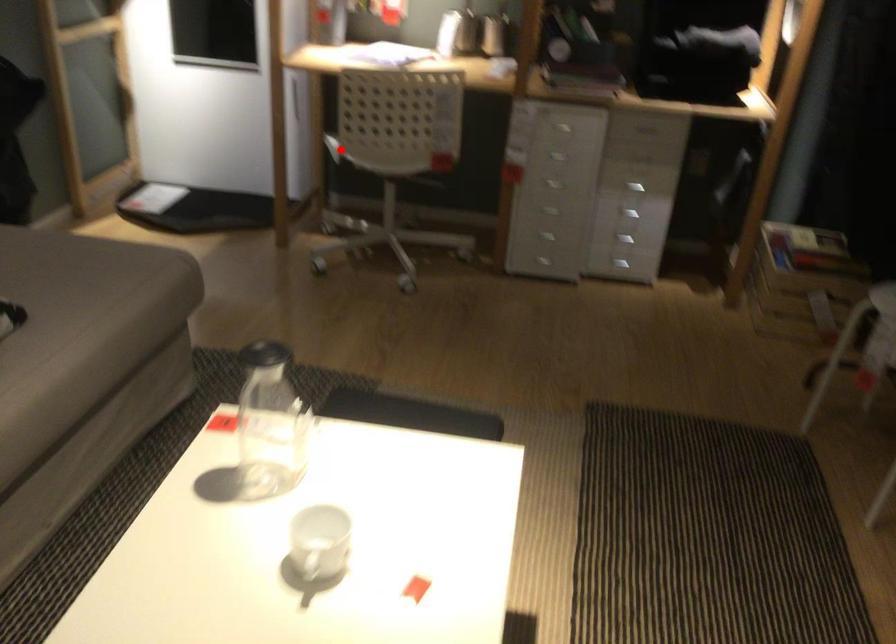
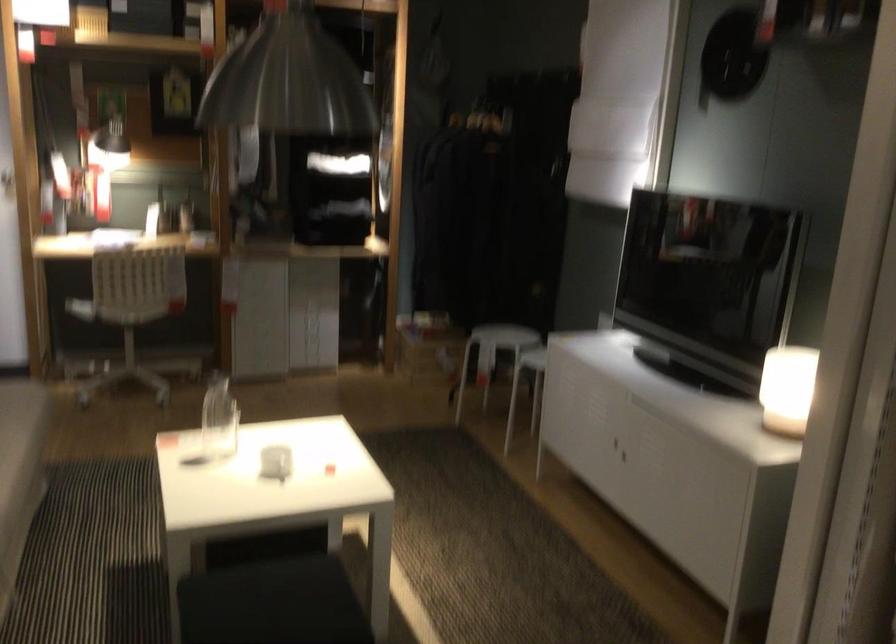
Locate, in the second image, the point that corresponds to the highlighted location in the first image.

(80, 308)